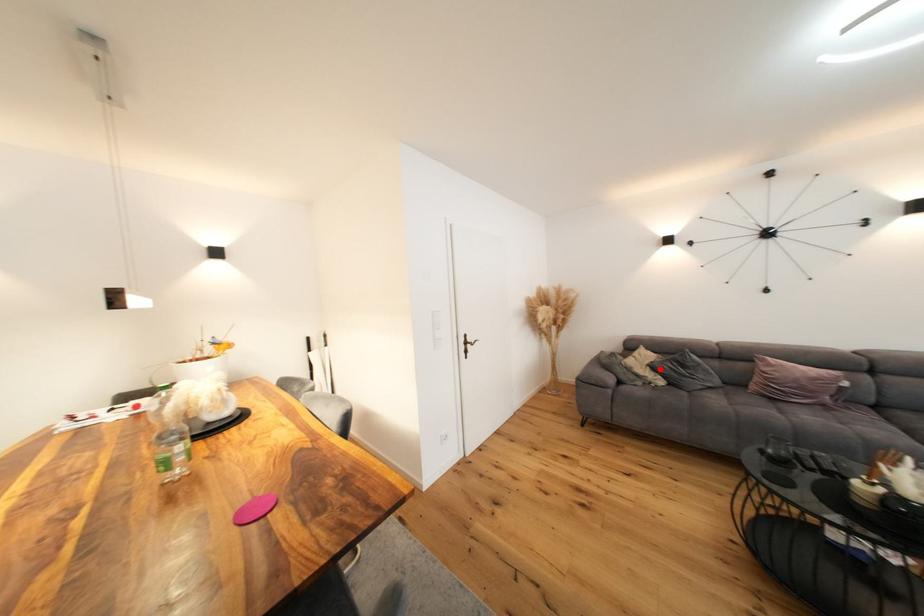
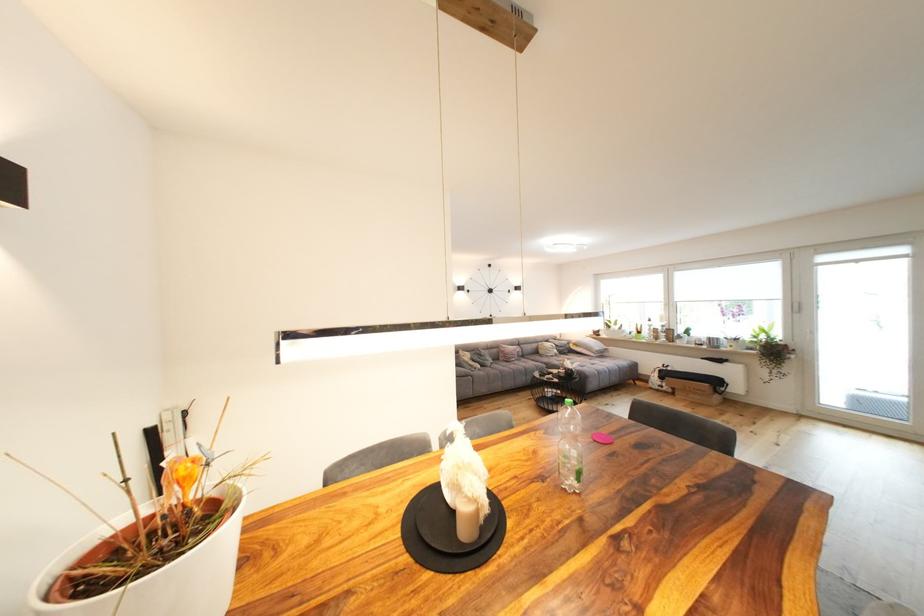
The point at the highlighted location is marked in the first image. Where is the corresponding point in the second image?

(480, 361)